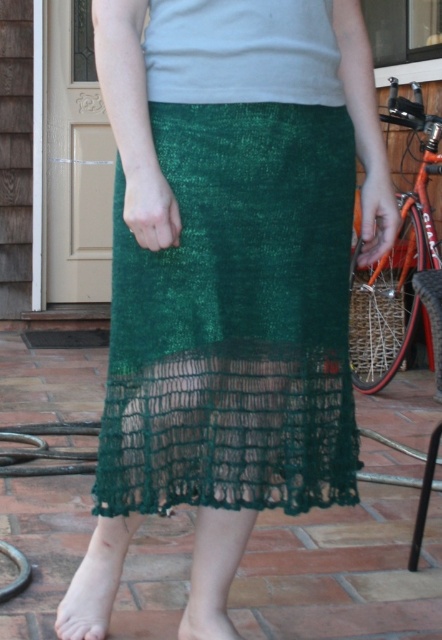
You are a fashion designer trying to create a matching outfit for the person in the image. The person wants to ensure that the distance between the green lace foot at lower center and the green knitted sock at lower center is exactly 12 inches. Based on the image, will the current spacing between these two items meet the requirement?

The green lace foot at lower center is 12.10 inches from the green knitted sock at lower center, which is slightly longer than the required 12 inches. Therefore, the current spacing does not exactly meet the requirement but is very close.

You are standing on the patio and want to place a small potted plant between the two points, point (83, 620) and point (201, 621). Which point should the plant be closer to in order to be placed behind the person?

To place the potted plant behind the person, it should be closer to point (83, 620) since it is behind point (201, 621).

You are a fashion designer observing the outfit of a person on a tiled patio. You notice the green lace foot at lower center and the green knitted sock at lower center. Which of these two items is longer in height?

The green lace foot at lower center is taller than the green knitted sock at lower center according to the description.